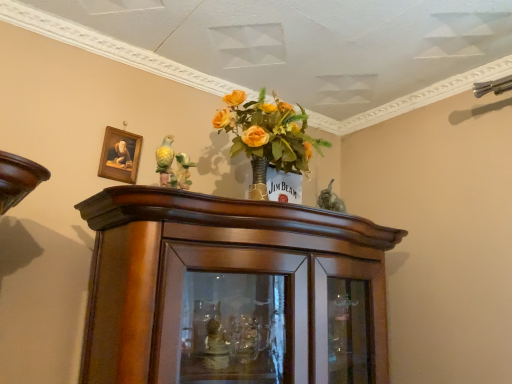
From the picture: What is the approximate height of wooden frame at upper left?

It is 7.43 inches.

Describe the element at coordinates (120, 155) in the screenshot. The image size is (512, 384). I see `wooden frame at upper left` at that location.

Identify the location of wooden frame at upper left. Image resolution: width=512 pixels, height=384 pixels. (120, 155).

Find the location of a particular element. The height and width of the screenshot is (384, 512). wooden frame at upper left is located at coordinates (120, 155).